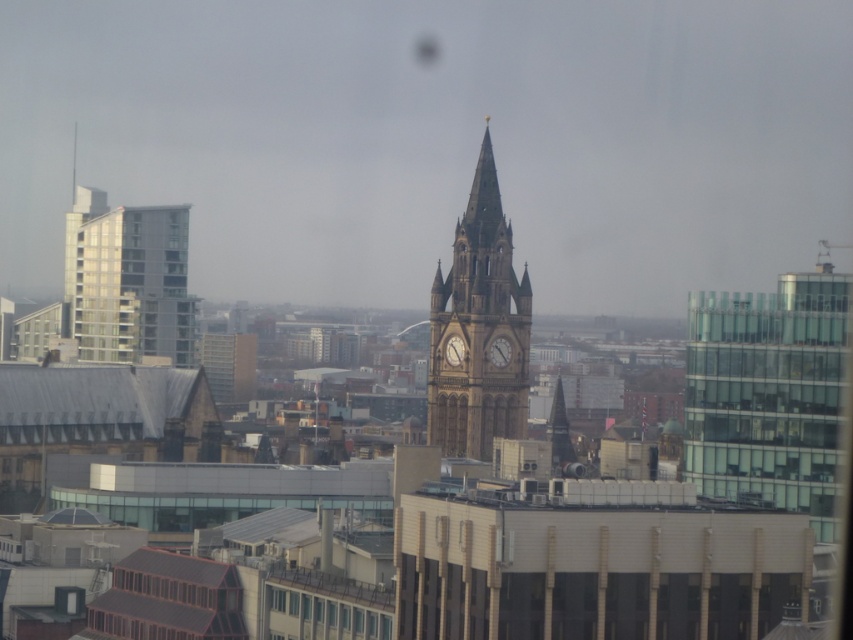
You are standing in the city square and want to take a photo of the clock tower. You notice the clear glass windows at center and the matte brown clock at center. Which object should you focus on first to ensure both are in sharp focus?

You should focus on the matte brown clock at center first because it is farther away than the clear glass windows at center. By focusing on the farther object, you can ensure both are within the depth of field.

You are standing in the city square and want to take a photo of the brown stone clock tower at center and the clear glass windows at center. Which object will appear larger in your photo?

The brown stone clock tower at center will appear larger in the photo because it is closer to the viewer than the clear glass windows at center.

Based on the cityscape scene described, which clock is positioned to the right when observing the golden stone clock at center and the matte brown clock at center?

The golden stone clock at center is positioned to the right of the matte brown clock at center.